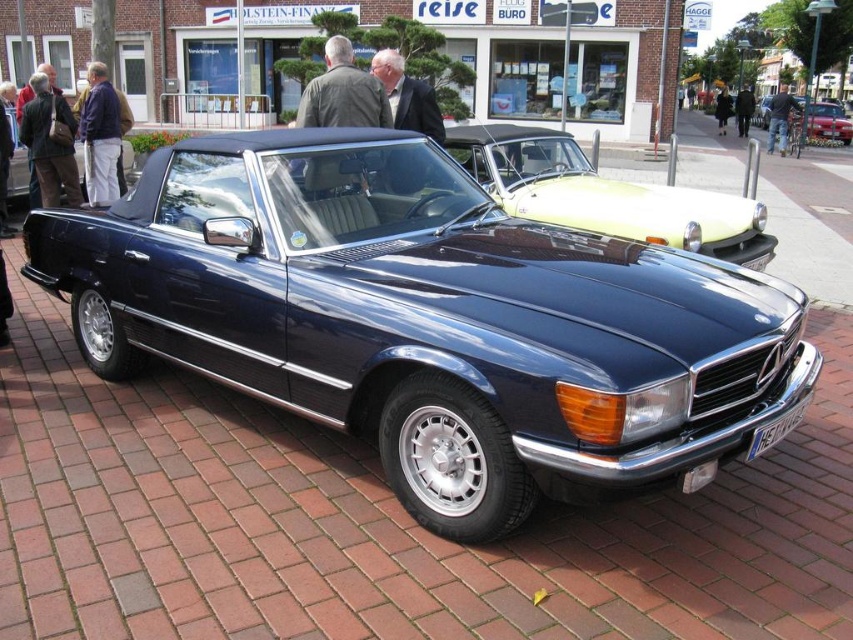
You are a photographer standing in front of the shiny dark blue convertible at center and the black leather jacket at center. You want to take a photo that includes both objects without any obstructions. Which object should you position closer to the camera to ensure both are fully visible?

The shiny dark blue convertible at center is not as tall as the black leather jacket at center, so you should position the shiny dark blue convertible at center closer to the camera to ensure both are fully visible.

You are standing in front of the Mercedes 380SL parked on the brick street. You see a dark brown leather jacket at left. Where exactly is the dark brown leather jacket located relative to the Mercedes 380SL?

The dark brown leather jacket at left is located at point (49,144) relative to the Mercedes 380SL.

You are standing in front of the Mercedes 380SL and looking at two points marked in the image. Which point, point [44,163] or point [730,109], is closer to you?

Point [44,163] is closer to the viewer than point [730,109].